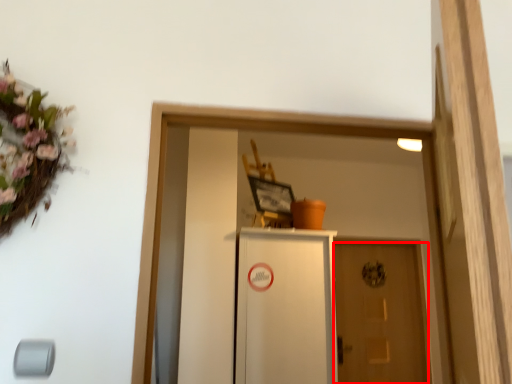
Question: From the image's perspective, considering the relative positions of door (annotated by the red box) and cabinetry in the image provided, where is door (annotated by the red box) located with respect to the staircase?

Choices:
 (A) above
 (B) below

Answer: (B)